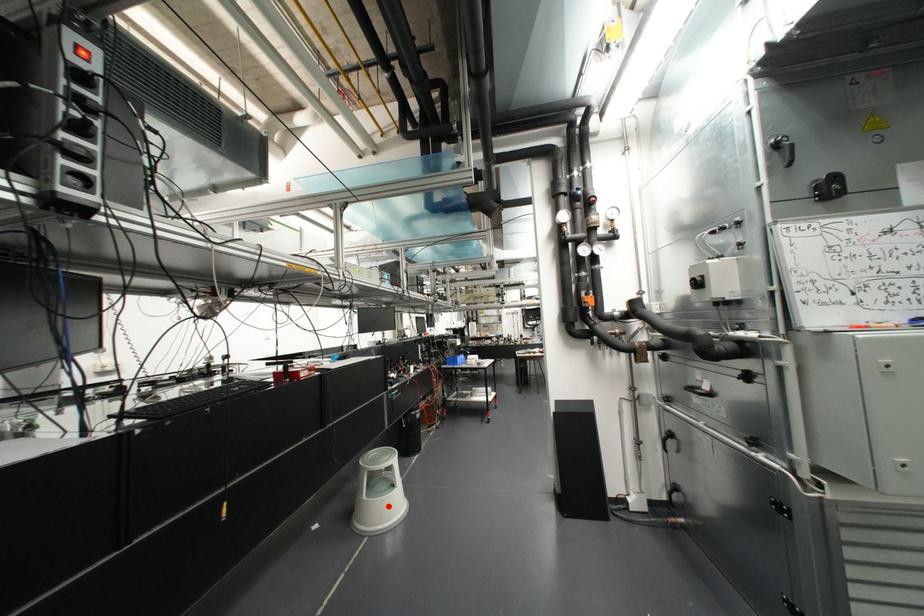
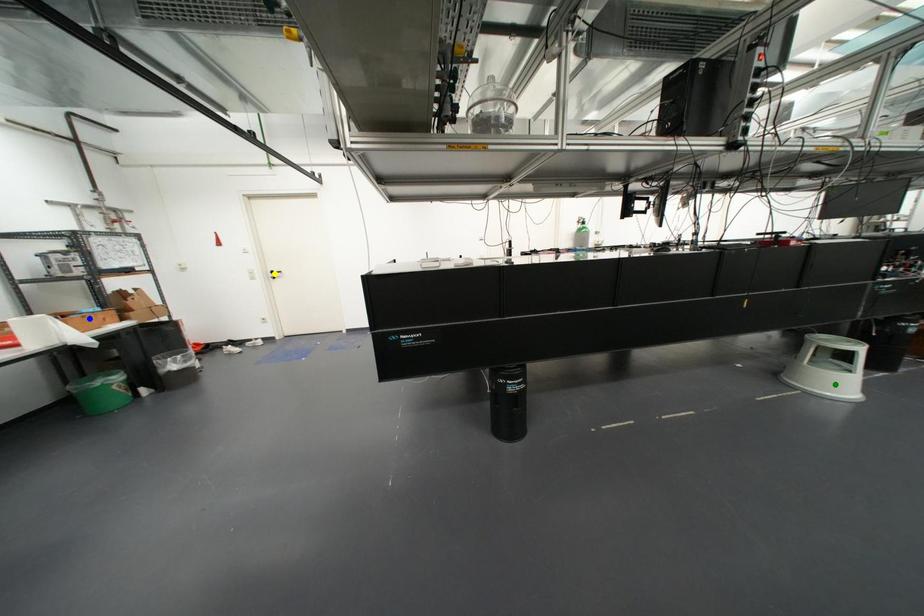
Question: I am providing you with two images of the same scene from different viewpoints. A red point is marked on the first image. You are given multiple points on the second image. Can you choose the point in image 2 that corresponds to the point in image 1?

Choices:
 (A) blue point
 (B) green point
 (C) yellow point

Answer: (B)